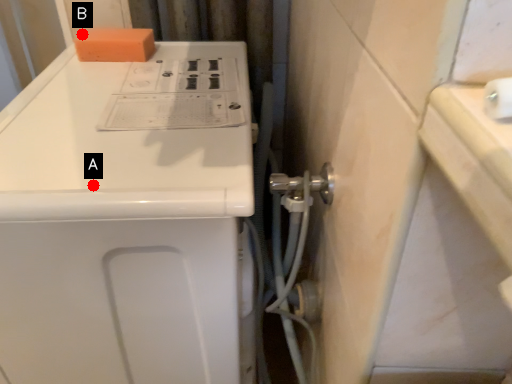
Question: Two points are circled on the image, labeled by A and B beside each circle. Which point appears farthest from the camera in this image?

Choices:
 (A) A is further
 (B) B is further

Answer: (B)